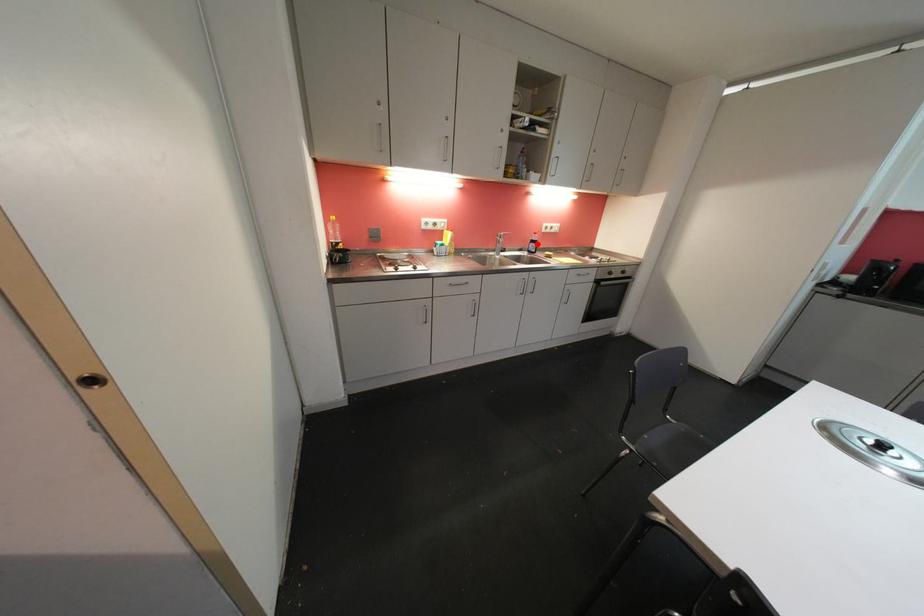
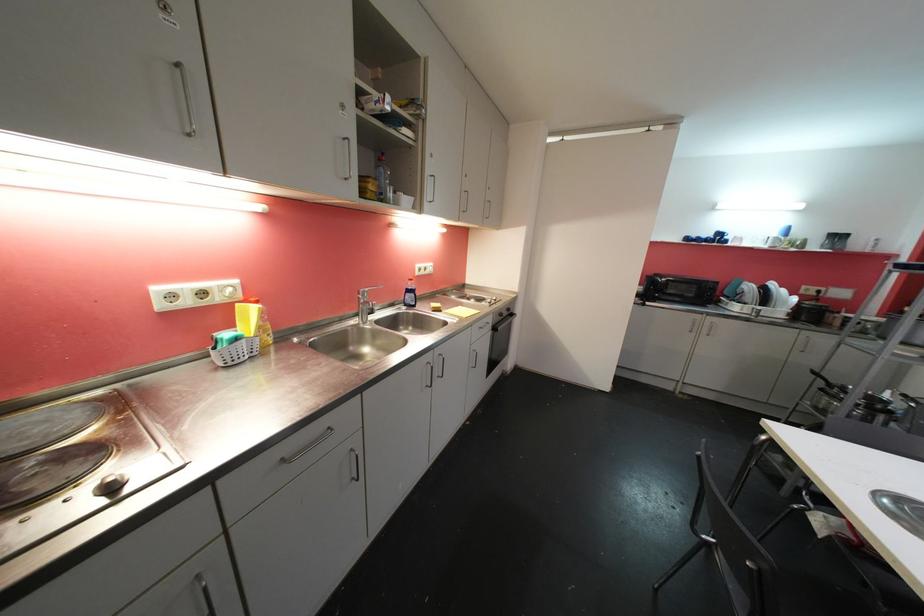
Where in the second image is the point corresponding to the highlighted location from the first image?

(414, 293)